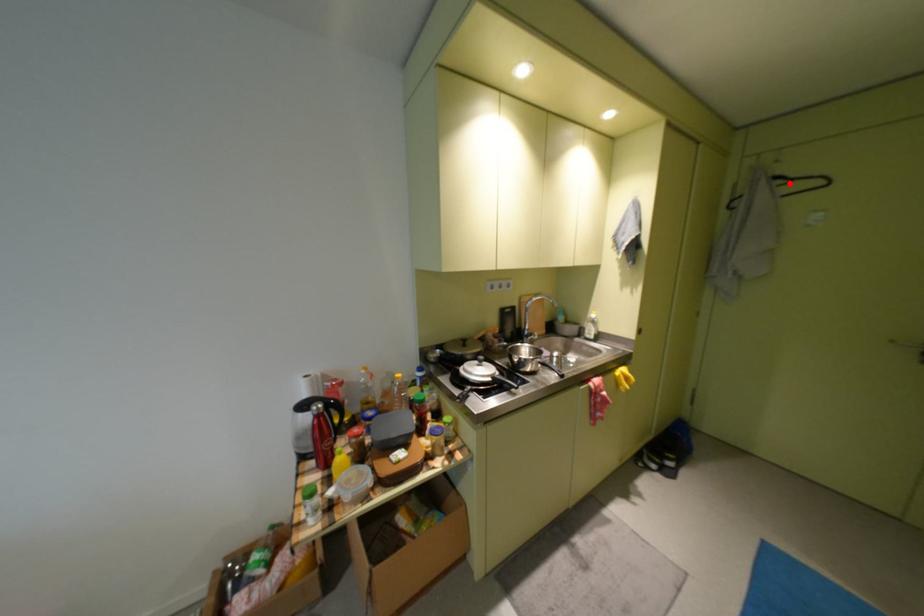
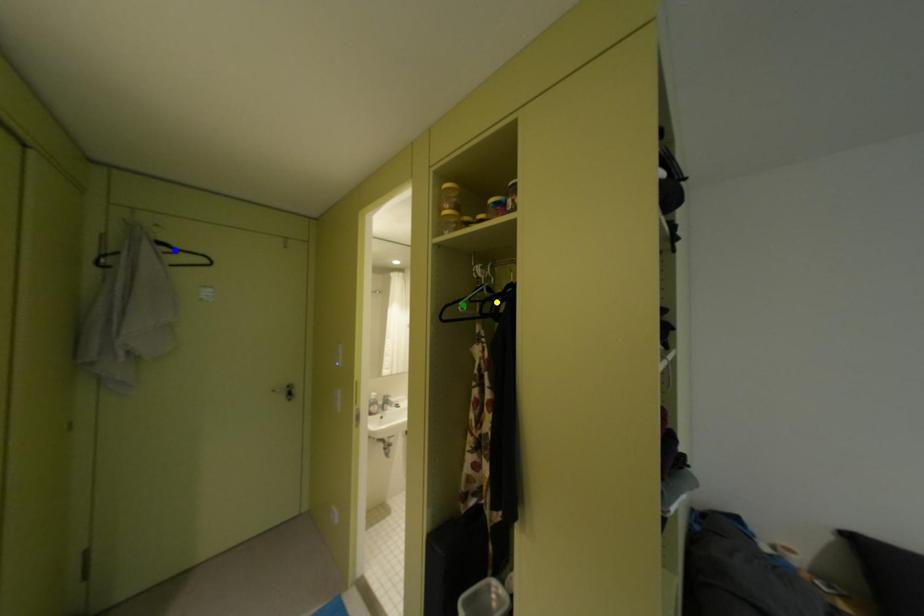
Question: I am providing you with two images of the same scene from different viewpoints. A red point is marked on the first image. You are given multiple points on the second image. Which point in image 2 is actually the same real-world point as the red point in image 1?

Choices:
 (A) green point
 (B) yellow point
 (C) blue point

Answer: (C)